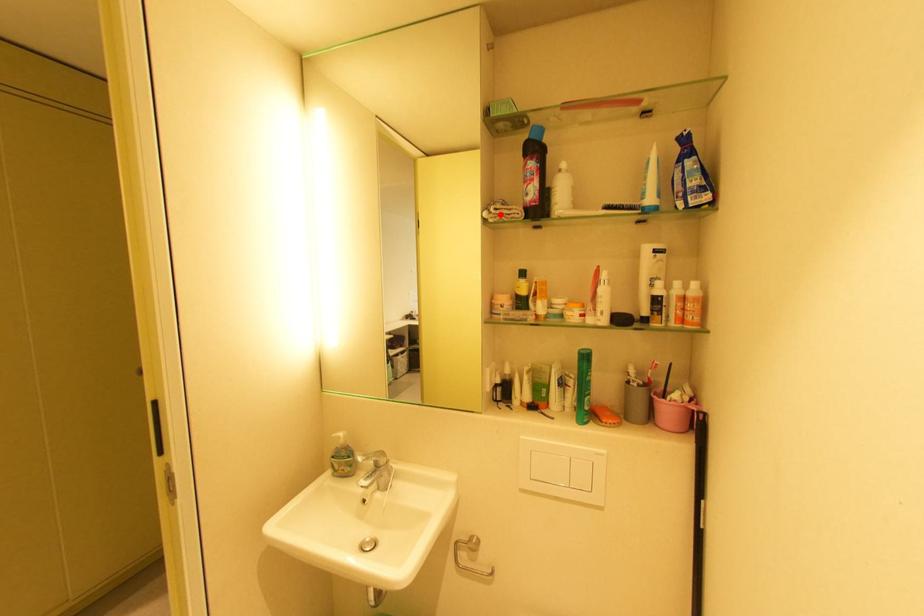
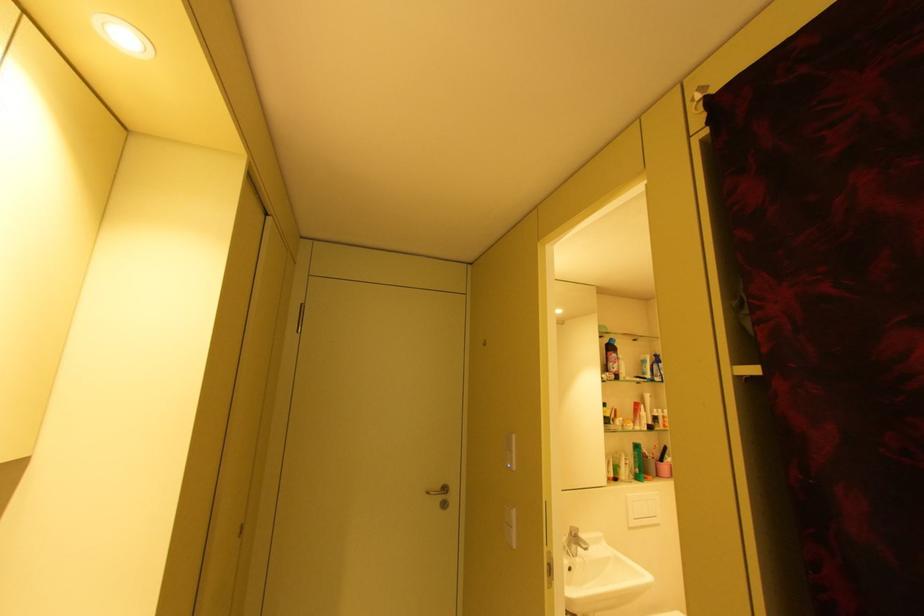
Find the pixel in the second image that matches the highlighted location in the first image.

(614, 377)